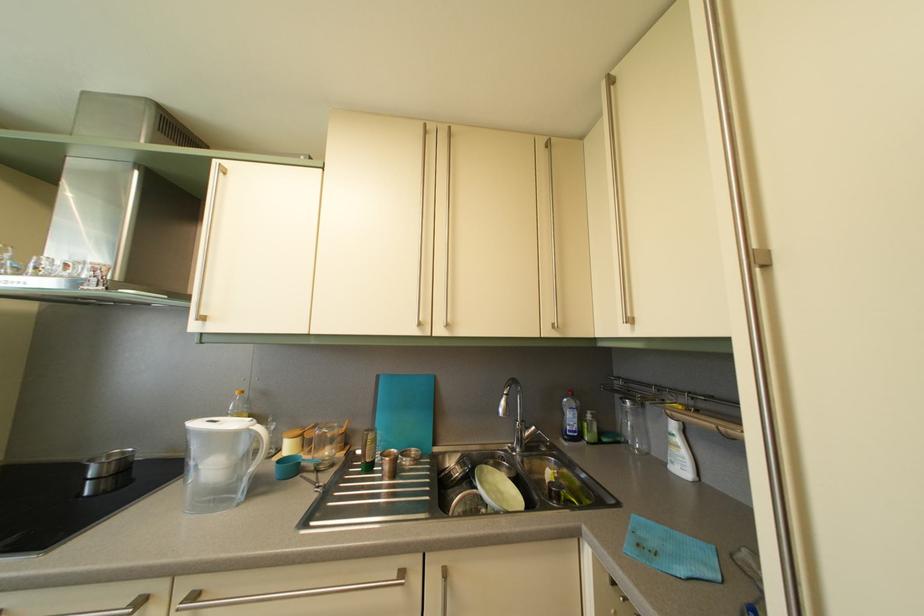
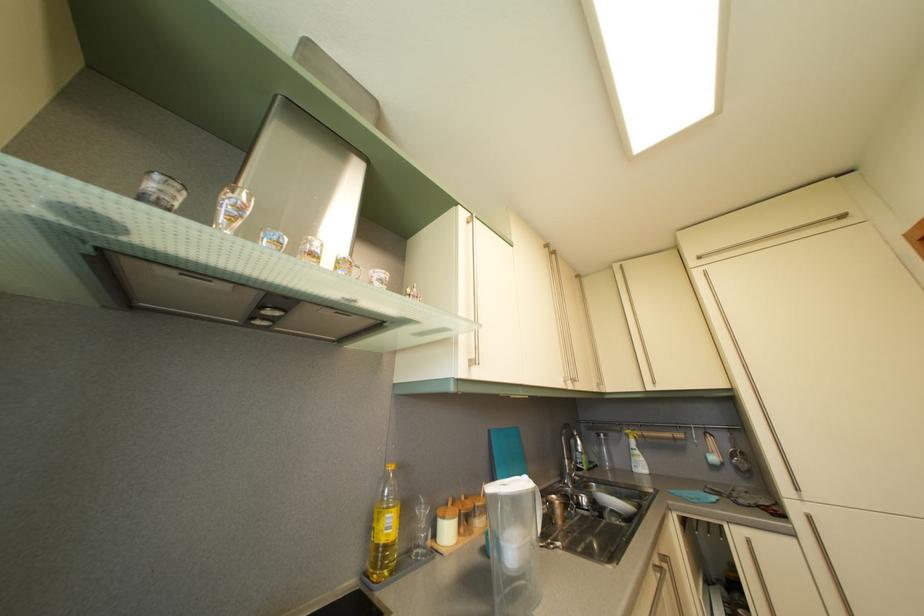
Where in the second image is the point corresponding to point 385,384 from the first image?

(497, 439)